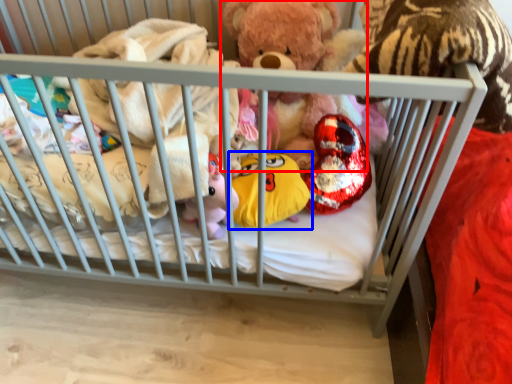
Question: Among these objects, which one is nearest to the camera, teddy bear (highlighted by a red box) or toy (highlighted by a blue box)?

Choices:
 (A) teddy bear
 (B) toy

Answer: (B)